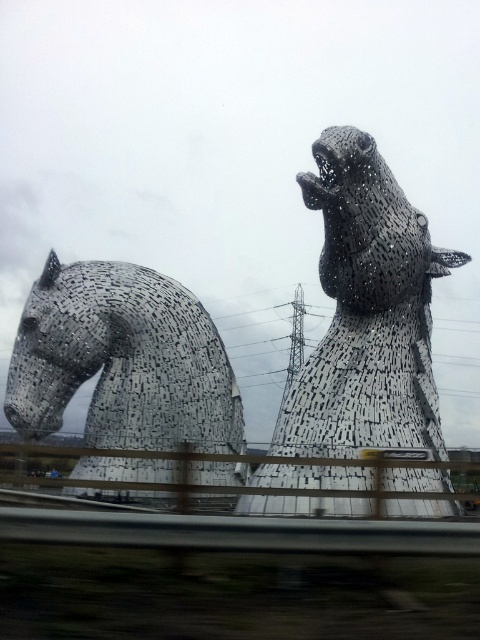
Question: Which point is closer to the camera?

Choices:
 (A) (115, 285)
 (B) (337, 168)

Answer: (B)

Question: Can you confirm if black textured horse at upper center is smaller than black textured horse at left?

Choices:
 (A) yes
 (B) no

Answer: (A)

Question: Is black textured horse at upper center in front of black textured horse at left?

Choices:
 (A) yes
 (B) no

Answer: (B)

Question: Which of the following is the farthest from the observer?

Choices:
 (A) (134, 269)
 (B) (400, 212)

Answer: (A)

Question: Among these objects, which one is farthest from the camera?

Choices:
 (A) black textured horse at upper center
 (B) black textured horse at left

Answer: (A)

Question: Does black textured horse at upper center appear on the left side of black textured horse at left?

Choices:
 (A) yes
 (B) no

Answer: (B)